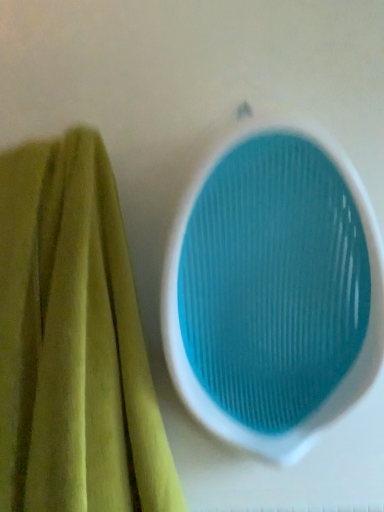
Question: From a real-world perspective, is blue textured bowl at center above or below green velvety towel at left?

Choices:
 (A) below
 (B) above

Answer: (B)

Question: Considering the positions of blue textured bowl at center and green velvety towel at left in the image, is blue textured bowl at center wider or thinner than green velvety towel at left?

Choices:
 (A) wide
 (B) thin

Answer: (B)

Question: Is point (369, 339) closer or farther from the camera than point (66, 372)?

Choices:
 (A) closer
 (B) farther

Answer: (B)

Question: In terms of width, does green velvety towel at left look wider or thinner when compared to blue textured bowl at center?

Choices:
 (A) thin
 (B) wide

Answer: (B)

Question: From a real-world perspective, relative to blue textured bowl at center, is green velvety towel at left vertically above or below?

Choices:
 (A) above
 (B) below

Answer: (B)

Question: Relative to blue textured bowl at center, is green velvety towel at left in front or behind?

Choices:
 (A) behind
 (B) front

Answer: (B)

Question: Is green velvety towel at left taller or shorter than blue textured bowl at center?

Choices:
 (A) tall
 (B) short

Answer: (A)